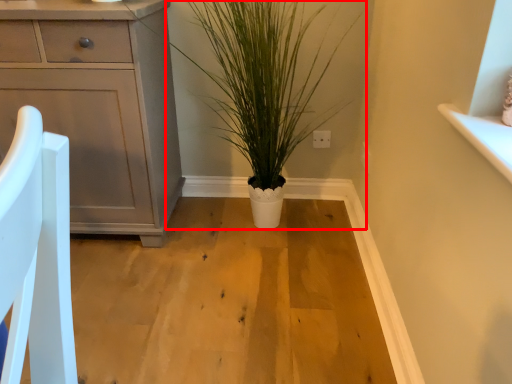
Question: From the image's perspective, what is the correct spatial positioning of houseplant (annotated by the red box) in reference to chest of drawers?

Choices:
 (A) below
 (B) above

Answer: (B)